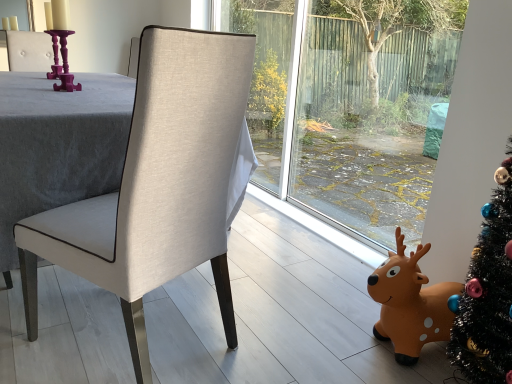
Question: Can you confirm if purple glossy candle holder at upper left is positioned to the left of matte beige fabric chair at center?

Choices:
 (A) no
 (B) yes

Answer: (B)

Question: From the image's perspective, would you say purple glossy candle holder at upper left is positioned over matte beige fabric chair at center?

Choices:
 (A) yes
 (B) no

Answer: (A)

Question: Can you confirm if purple glossy candle holder at upper left is smaller than matte beige fabric chair at center?

Choices:
 (A) yes
 (B) no

Answer: (A)

Question: Is purple glossy candle holder at upper left taller than matte beige fabric chair at center?

Choices:
 (A) yes
 (B) no

Answer: (B)

Question: From a real-world perspective, does purple glossy candle holder at upper left sit lower than matte beige fabric chair at center?

Choices:
 (A) no
 (B) yes

Answer: (A)

Question: Considering the positions of matte beige fabric chair at center and purple glossy candle holder at upper left in the image, is matte beige fabric chair at center taller or shorter than purple glossy candle holder at upper left?

Choices:
 (A) tall
 (B) short

Answer: (A)

Question: Considering the positions of matte beige fabric chair at center and purple glossy candle holder at upper left in the image, is matte beige fabric chair at center bigger or smaller than purple glossy candle holder at upper left?

Choices:
 (A) small
 (B) big

Answer: (B)

Question: Considering the positions of point (89, 279) and point (58, 74), is point (89, 279) closer or farther from the camera than point (58, 74)?

Choices:
 (A) farther
 (B) closer

Answer: (B)

Question: From a real-world perspective, is matte beige fabric chair at center above or below purple glossy candle holder at upper left?

Choices:
 (A) below
 (B) above

Answer: (A)

Question: From the image's perspective, is orange rubber reindeer at lower right above or below matte beige fabric chair at center?

Choices:
 (A) above
 (B) below

Answer: (B)

Question: From a real-world perspective, is orange rubber reindeer at lower right physically located above or below matte beige fabric chair at center?

Choices:
 (A) above
 (B) below

Answer: (B)

Question: From their relative heights in the image, would you say orange rubber reindeer at lower right is taller or shorter than matte beige fabric chair at center?

Choices:
 (A) short
 (B) tall

Answer: (A)

Question: Is orange rubber reindeer at lower right bigger or smaller than matte beige fabric chair at center?

Choices:
 (A) big
 (B) small

Answer: (B)

Question: Relative to orange rubber reindeer at lower right, is matte beige fabric chair at center in front or behind?

Choices:
 (A) behind
 (B) front

Answer: (B)

Question: In terms of width, does matte beige fabric chair at center look wider or thinner when compared to orange rubber reindeer at lower right?

Choices:
 (A) thin
 (B) wide

Answer: (B)